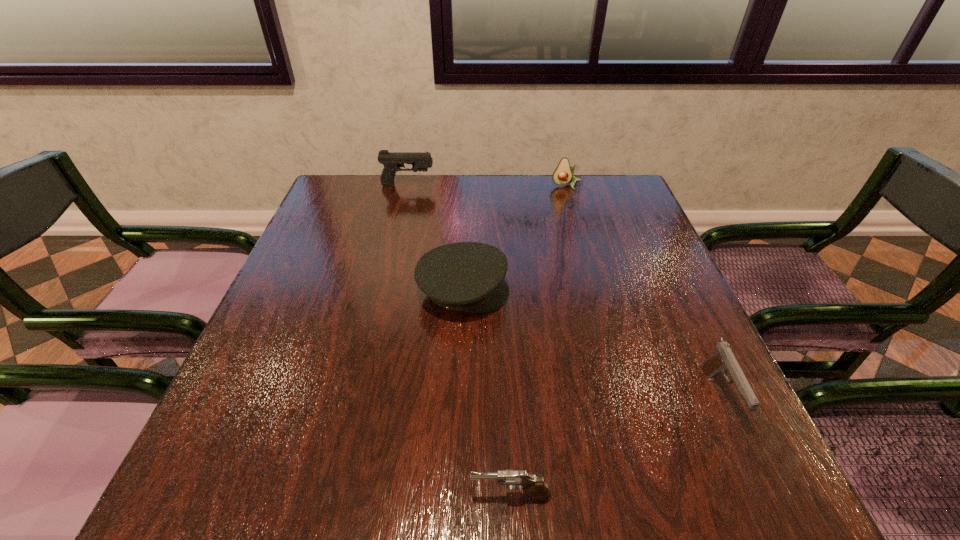
Where is `empty space that is in between the farthest pistol and the shortest object`? The width and height of the screenshot is (960, 540). empty space that is in between the farthest pistol and the shortest object is located at coordinates (459, 340).

You are a GUI agent. You are given a task and a screenshot of the screen. Output one action in this format:
    pyautogui.click(x=<x>, y=<y>)
    Task: Click on the vacant space in between the rightmost object and the shortest pistol
    This screenshot has width=960, height=540.
    Given the screenshot: What is the action you would take?
    pyautogui.click(x=614, y=446)

At what (x,y) coordinates should I click in order to perform the action: click on vacant area between the rightmost object and the farthest pistol. Please return your answer as a coordinate pair (x, y). The width and height of the screenshot is (960, 540). Looking at the image, I should click on (564, 291).

You are a GUI agent. You are given a task and a screenshot of the screen. Output one action in this format:
    pyautogui.click(x=<x>, y=<y>)
    Task: Click on the free space between the shortest object and the rightmost object
    
    Given the screenshot: What is the action you would take?
    pyautogui.click(x=614, y=446)

Locate an element on the screen. blank region between the second nearest object and the farthest pistol is located at coordinates (564, 291).

I want to click on free point between the third nearest object and the fourth object from left to right, so click(x=515, y=239).

At what (x,y) coordinates should I click in order to perform the action: click on vacant space that is in between the fourth object from left to right and the third nearest object. Please return your answer as a coordinate pair (x, y). The height and width of the screenshot is (540, 960). Looking at the image, I should click on (515, 239).

This screenshot has height=540, width=960. I want to click on free space between the second object from right to left and the third farthest object, so click(515, 239).

This screenshot has height=540, width=960. In order to click on free area in between the second shortest pistol and the second pistol from right to left in this screenshot , I will do `click(614, 446)`.

This screenshot has height=540, width=960. In order to click on free spot between the rightmost object and the third farthest object in this screenshot , I will do point(591,344).